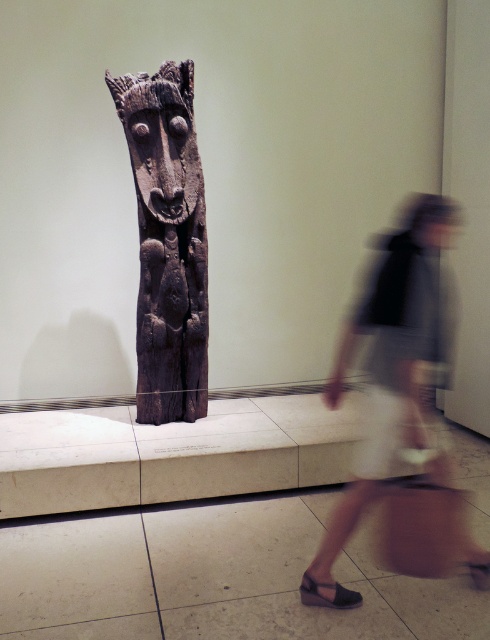
In the scene shown: You are an artist observing the museum scene. You notice the light beige skirt at lower right and the black leather sandal at lower center. Which object is positioned higher in the image?

The light beige skirt at lower right is above the black leather sandal at lower center, so the light beige skirt at lower right is positioned higher in the image.

In the scene shown: Where is the dark wood carving at center located in the image?

The dark wood carving at center is located at point (168,241).

In the museum scene, there is a wooden sculpture displayed against a plain off white wall. A blurred person wearing a dark top is walking past the sculpture. Can you tell me what color the skirt of the person is at the point (x=405, y=406)?

The point (x=405, y=406) indicates light beige skirt at lower right.